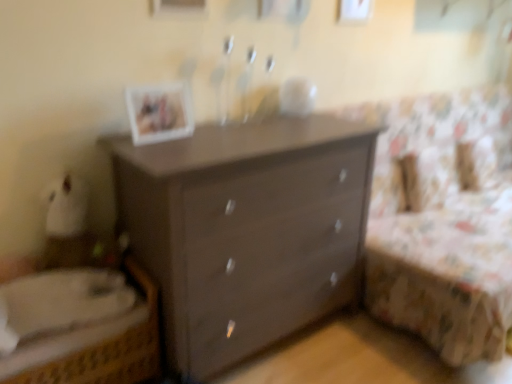
Find the location of a particular element. This screenshot has height=384, width=512. vacant region above matte brown dresser at center (from a real-world perspective) is located at coordinates (247, 128).